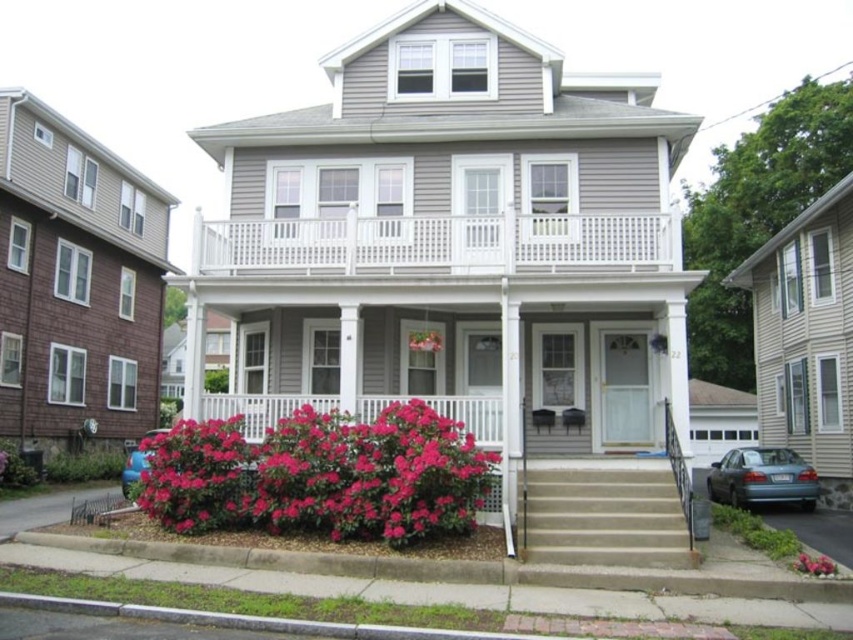
Question: Which point is farther to the camera?

Choices:
 (A) (817, 557)
 (B) (537, 243)
 (C) (634, 522)

Answer: (B)

Question: Which point is farther to the camera?

Choices:
 (A) (817, 563)
 (B) (136, 477)

Answer: (B)

Question: Is vivid pink petals at lower center further to camera compared to pink matte flower at lower right?

Choices:
 (A) no
 (B) yes

Answer: (B)

Question: Which point is farther to the camera?

Choices:
 (A) coord(122,481)
 (B) coord(386,557)
 (C) coord(444,241)
 (D) coord(779,448)

Answer: (D)

Question: Observing the image, what is the correct spatial positioning of concrete stairs at center in reference to pink matte flower at center?

Choices:
 (A) above
 (B) below

Answer: (B)

Question: Is vivid pink petals at lower center positioned behind blue metallic car at lower left?

Choices:
 (A) yes
 (B) no

Answer: (B)